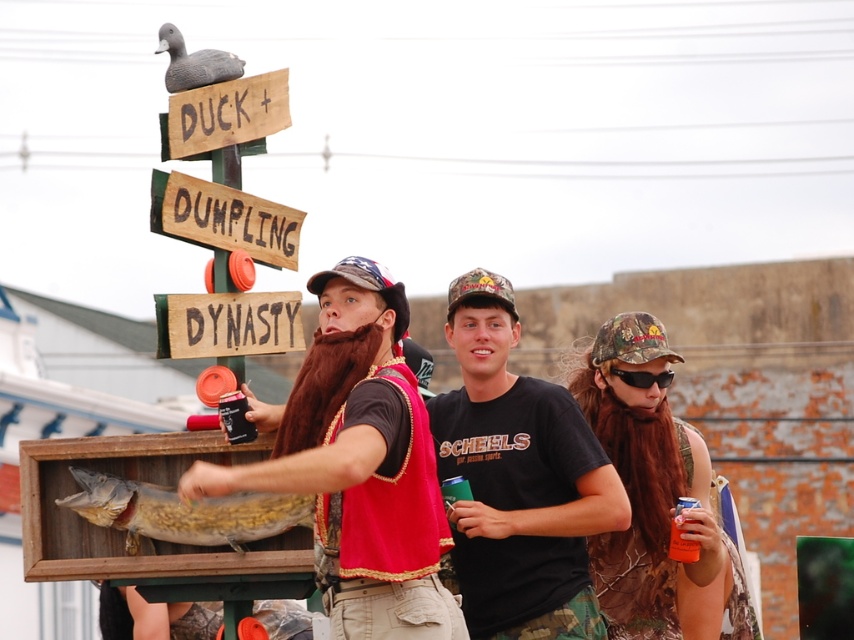
Question: Estimate the real-world distances between objects in this image. Which object is closer to the red velvet vest at center?

Choices:
 (A) camo fabric baseball cap at center
 (B) black matte t-shirt at center
 (C) wooden signboard at center
 (D) american flag fabric baseball cap at center

Answer: (C)

Question: Observing the image, what is the correct spatial positioning of red velvet vest at center in reference to matte gray duck at upper left?

Choices:
 (A) below
 (B) above

Answer: (A)

Question: Is red velvet vest at center closer to the viewer compared to matte gray duck at upper left?

Choices:
 (A) yes
 (B) no

Answer: (A)

Question: Which point appears closest to the camera in this image?

Choices:
 (A) (294, 317)
 (B) (205, 202)
 (C) (199, 67)
 (D) (654, 364)

Answer: (B)

Question: Is black matte t-shirt at center above camouflage fabric baseball cap at right?

Choices:
 (A) yes
 (B) no

Answer: (B)

Question: Which point appears farthest from the camera in this image?

Choices:
 (A) (617, 317)
 (B) (177, 112)
 (C) (202, 76)
 (D) (184, 348)

Answer: (A)